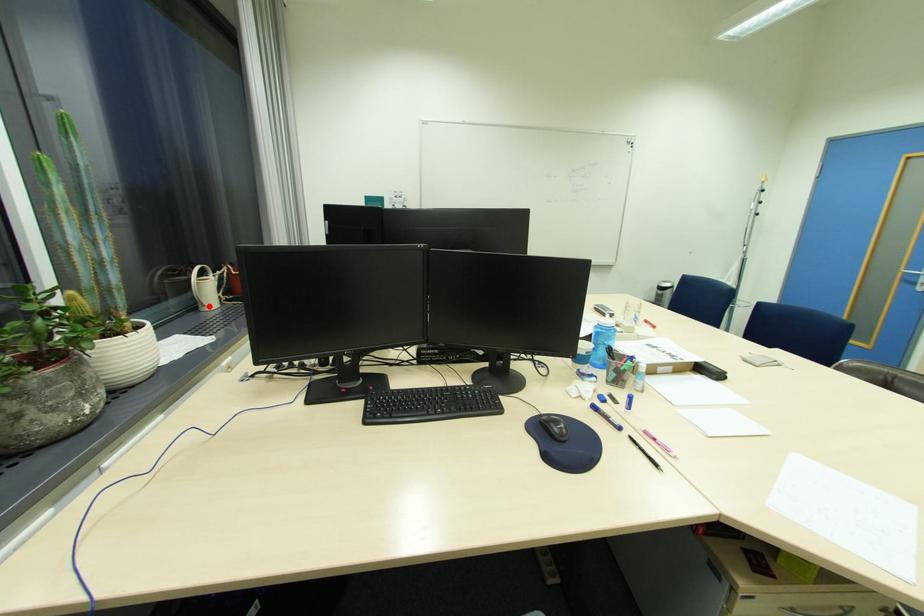
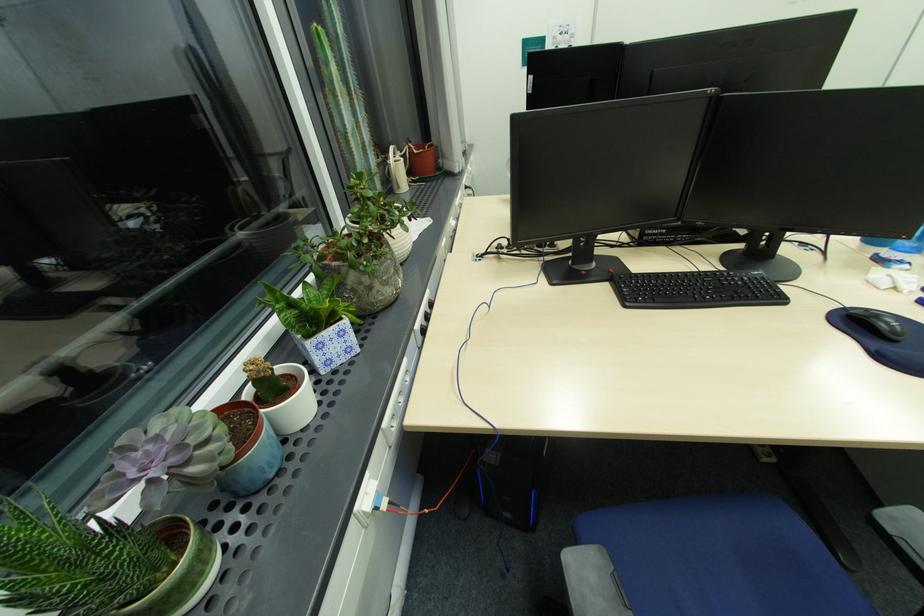
Locate, in the second image, the point that corresponds to the highlighted location in the first image.

(406, 188)